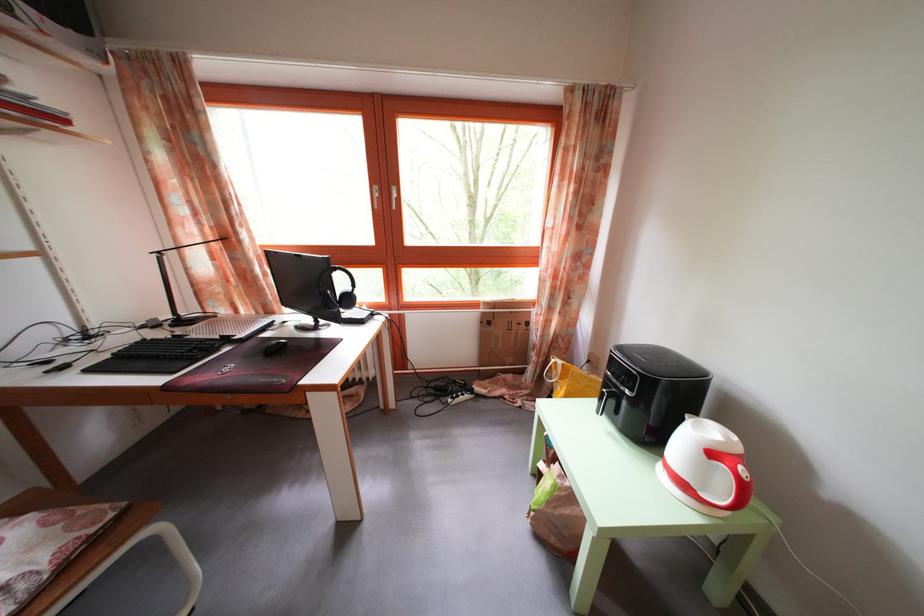
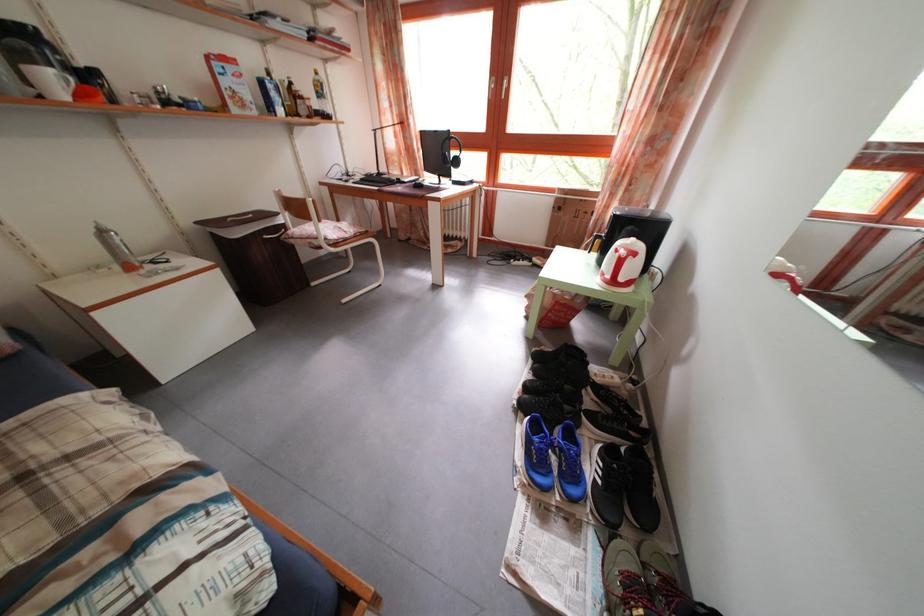
Locate, in the second image, the point that corresponds to point 249,318 in the first image.

(412, 182)